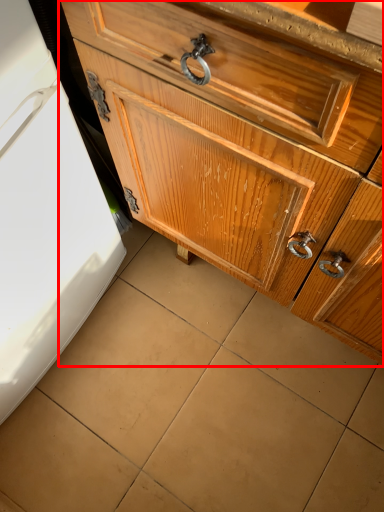
Question: Observing the image, what is the correct spatial positioning of chest of drawers (annotated by the red box) in reference to tile?

Choices:
 (A) left
 (B) right

Answer: (B)